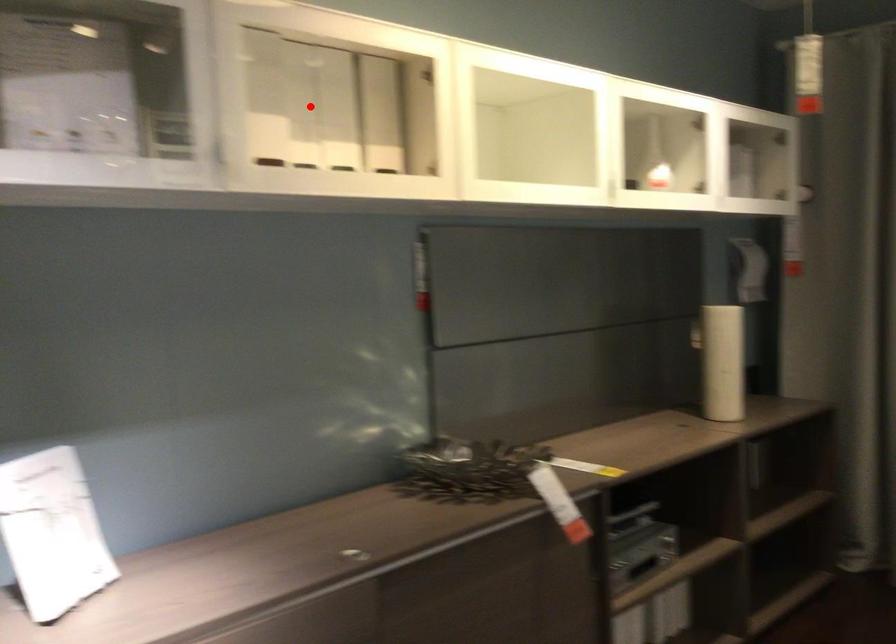
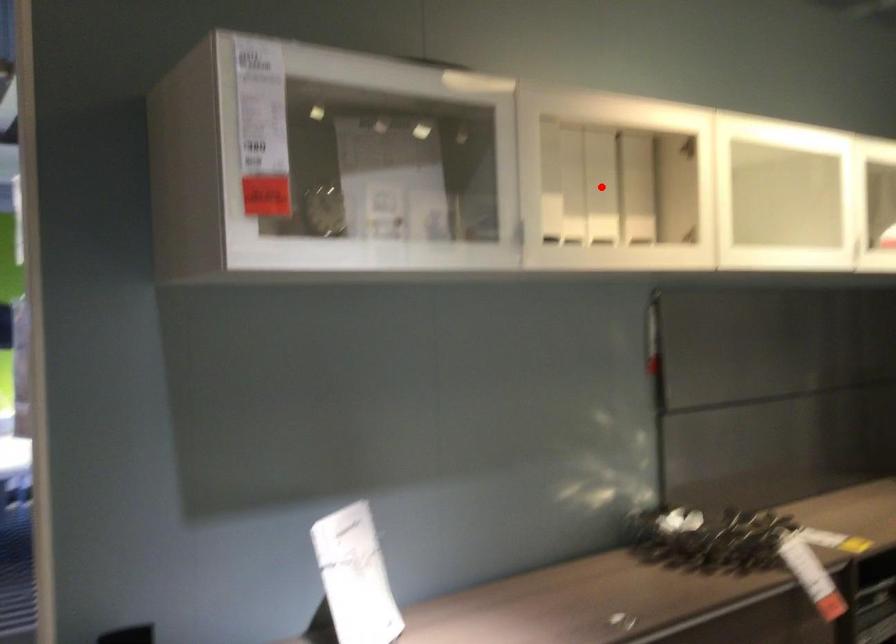
From the picture: I am providing you with two images of the same scene from different viewpoints. A red point is marked on the first image and another point is marked on the second image. Are the points marked in image1 and image2 representing the same 3D position?

No